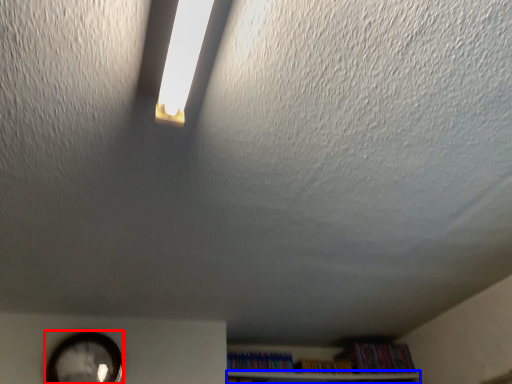
Question: Which point is closer to the camera, clock (highlighted by a red box) or shelf (highlighted by a blue box)?

Choices:
 (A) clock
 (B) shelf

Answer: (A)